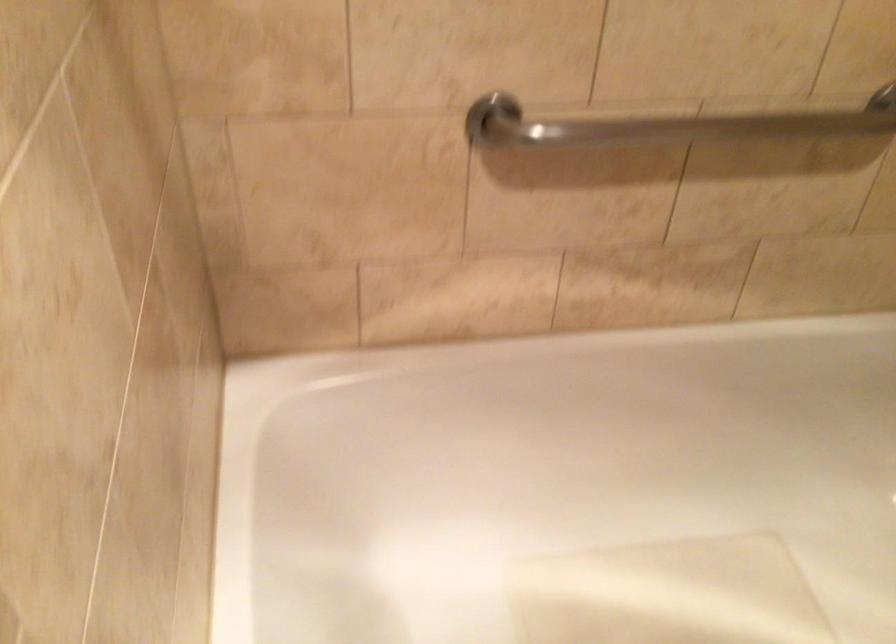
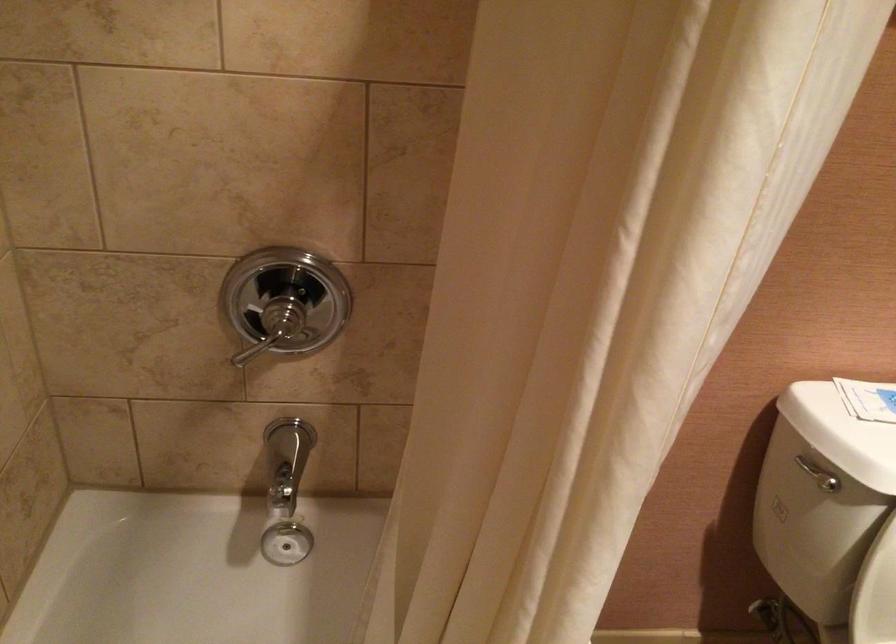
The first image is from the beginning of the video and the second image is from the end. How did the camera likely rotate when shooting the video?

The camera rotated toward right-down.